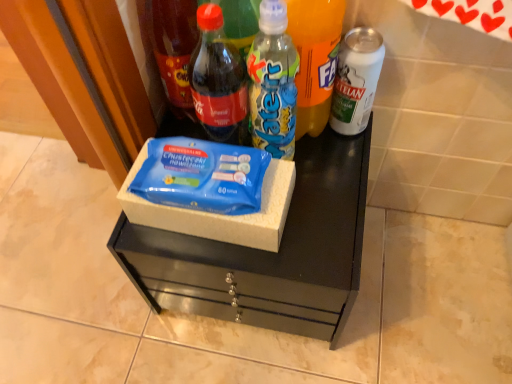
This screenshot has width=512, height=384. What do you see at coordinates (356, 80) in the screenshot?
I see `white matte can at right, marked as the 1th bottle in a right-to-left arrangement` at bounding box center [356, 80].

This screenshot has width=512, height=384. In order to click on translucent plastic bottle at center, placed as the second bottle when sorted from right to left in this screenshot , I will do `click(315, 59)`.

The height and width of the screenshot is (384, 512). Find the location of `blue matte wipes at center`. blue matte wipes at center is located at coordinates (268, 252).

Image resolution: width=512 pixels, height=384 pixels. Find the location of `matte glass bottle at center, positioned as the 4th bottle in right-to-left order`. matte glass bottle at center, positioned as the 4th bottle in right-to-left order is located at coordinates (218, 81).

The image size is (512, 384). Describe the element at coordinates (218, 81) in the screenshot. I see `matte glass bottle at center, positioned as the second bottle in left-to-right order` at that location.

In order to click on white matte can at right, the fifth bottle viewed from the left in this screenshot , I will do `click(356, 80)`.

In the scene shown: Is translucent plastic bottle at center, the fourth bottle positioned from the left, oriented towards blue matte wipes at center?

No.

Starting from the blue matte wipes at center, which bottle is the 2nd one to the right? Please provide its 2D coordinates.

[(315, 59)]

From the picture: Can you confirm if translucent plastic bottle at center, the fourth bottle positioned from the left, is positioned to the left of blue matte wipes at center?

Incorrect, translucent plastic bottle at center, the fourth bottle positioned from the left, is not on the left side of blue matte wipes at center.

Consider the image. Measure the distance from translucent plastic bottle at center, the fourth bottle positioned from the left, to blue matte wipes at center.

translucent plastic bottle at center, the fourth bottle positioned from the left, and blue matte wipes at center are 9.50 inches apart from each other.

Find the location of a particular element. Image resolution: width=512 pixels, height=384 pixels. bottle that is the 3rd object located behind the translucent plastic water bottle at center, the 3th bottle from the left is located at coordinates (356, 80).

Considering the relative sizes of white matte can at right, marked as the 1th bottle in a right-to-left arrangement, and translucent plastic water bottle at center, the 3th bottle from the left, in the image provided, is white matte can at right, marked as the 1th bottle in a right-to-left arrangement, thinner than translucent plastic water bottle at center, the 3th bottle from the left,?

Incorrect, the width of white matte can at right, marked as the 1th bottle in a right-to-left arrangement, is not less than that of translucent plastic water bottle at center, the 3th bottle from the left.

From a real-world perspective, is white matte can at right, the fifth bottle viewed from the left, physically below translucent plastic water bottle at center, the 3th bottle from the left?

Indeed, from a real-world perspective, white matte can at right, the fifth bottle viewed from the left, is positioned beneath translucent plastic water bottle at center, the 3th bottle from the left.

Is the position of matte glass bottle at upper left, arranged as the 5th bottle when viewed from the right, more distant than that of translucent plastic water bottle at center, which is counted as the third bottle, starting from the right?

Yes, the depth of matte glass bottle at upper left, arranged as the 5th bottle when viewed from the right, is greater than that of translucent plastic water bottle at center, which is counted as the third bottle, starting from the right.

Is point (188, 7) closer or farther from the camera than point (255, 41)?

Point (188, 7) is positioned farther from the camera compared to point (255, 41).

Considering the relative sizes of matte glass bottle at upper left, arranged as the 5th bottle when viewed from the right, and translucent plastic water bottle at center, which is counted as the third bottle, starting from the right, in the image provided, is matte glass bottle at upper left, arranged as the 5th bottle when viewed from the right, smaller than translucent plastic water bottle at center, which is counted as the third bottle, starting from the right,?

No, matte glass bottle at upper left, arranged as the 5th bottle when viewed from the right, is not smaller than translucent plastic water bottle at center, which is counted as the third bottle, starting from the right.

From the picture: Is blue matte wipes at center closer to the viewer compared to white matte can at right, the fifth bottle viewed from the left?

Yes, blue matte wipes at center is closer to the camera.

Looking at this image, would you say blue matte wipes at center is inside or outside white matte can at right, marked as the 1th bottle in a right-to-left arrangement?

blue matte wipes at center is not inside white matte can at right, marked as the 1th bottle in a right-to-left arrangement, it's outside.

Looking at this image, measure the distance between blue matte wipes at center and white matte can at right, marked as the 1th bottle in a right-to-left arrangement.

9.97 inches.

In terms of height, does blue matte wipes at center look taller or shorter compared to white matte can at right, the fifth bottle viewed from the left?

Clearly, blue matte wipes at center is taller compared to white matte can at right, the fifth bottle viewed from the left.

Who is more distant, translucent plastic bottle at center, the fourth bottle positioned from the left, or matte glass bottle at center, positioned as the 4th bottle in right-to-left order?

matte glass bottle at center, positioned as the 4th bottle in right-to-left order, is further from the camera.

Which is farther, (319, 68) or (241, 78)?

The point (319, 68) is farther.

From the image's perspective, would you say translucent plastic bottle at center, placed as the second bottle when sorted from right to left, is shown under matte glass bottle at center, positioned as the 4th bottle in right-to-left order?

Incorrect, from the image's perspective, translucent plastic bottle at center, placed as the second bottle when sorted from right to left, is higher than matte glass bottle at center, positioned as the 4th bottle in right-to-left order.

Considering the positions of objects translucent plastic bottle at center, placed as the second bottle when sorted from right to left, and matte glass bottle at center, positioned as the 4th bottle in right-to-left order, in the image provided, who is more to the left, translucent plastic bottle at center, placed as the second bottle when sorted from right to left, or matte glass bottle at center, positioned as the 4th bottle in right-to-left order,?

matte glass bottle at center, positioned as the 4th bottle in right-to-left order.

In the image, is translucent plastic water bottle at center, which is counted as the third bottle, starting from the right, positioned in front of or behind matte glass bottle at center, positioned as the 4th bottle in right-to-left order?

Clearly, translucent plastic water bottle at center, which is counted as the third bottle, starting from the right, is in front of matte glass bottle at center, positioned as the 4th bottle in right-to-left order.

Identify the location of the 1st bottle in front of the matte glass bottle at center, positioned as the second bottle in left-to-right order. (273, 83).

Is translucent plastic water bottle at center, the 3th bottle from the left, facing away from matte glass bottle at center, positioned as the second bottle in left-to-right order?

No.

Consider the image. From the image's perspective, is matte glass bottle at center, positioned as the 4th bottle in right-to-left order, beneath white matte can at right, the fifth bottle viewed from the left?

Yes, from the image's perspective, matte glass bottle at center, positioned as the 4th bottle in right-to-left order, is beneath white matte can at right, the fifth bottle viewed from the left.

How distant is matte glass bottle at center, positioned as the 4th bottle in right-to-left order, from white matte can at right, the fifth bottle viewed from the left?

The distance of matte glass bottle at center, positioned as the 4th bottle in right-to-left order, from white matte can at right, the fifth bottle viewed from the left, is 7.07 inches.

Considering the sizes of objects matte glass bottle at center, positioned as the 4th bottle in right-to-left order, and white matte can at right, the fifth bottle viewed from the left, in the image provided, who is smaller, matte glass bottle at center, positioned as the 4th bottle in right-to-left order, or white matte can at right, the fifth bottle viewed from the left,?

white matte can at right, the fifth bottle viewed from the left, is smaller.

Based on the photo, is matte glass bottle at center, positioned as the second bottle in left-to-right order, far away from white matte can at right, marked as the 1th bottle in a right-to-left arrangement?

matte glass bottle at center, positioned as the second bottle in left-to-right order, is near white matte can at right, marked as the 1th bottle in a right-to-left arrangement, not far away.

From a real-world perspective, which bottle is the 4th one above the blue matte wipes at center? Please provide its 2D coordinates.

[(315, 59)]

The height and width of the screenshot is (384, 512). Find the location of `the 2nd bottle counting from the right side of the translucent plastic water bottle at center, the 3th bottle from the left`. the 2nd bottle counting from the right side of the translucent plastic water bottle at center, the 3th bottle from the left is located at coordinates (356, 80).

Which object lies nearer to the anchor point white matte can at right, the fifth bottle viewed from the left, matte glass bottle at center, positioned as the second bottle in left-to-right order, or translucent plastic water bottle at center, the 3th bottle from the left?

The object closer to white matte can at right, the fifth bottle viewed from the left, is translucent plastic water bottle at center, the 3th bottle from the left.

Looking at the image, which one is located further to blue matte wipes at center, matte glass bottle at center, positioned as the 4th bottle in right-to-left order, or translucent plastic bottle at center, placed as the second bottle when sorted from right to left?

translucent plastic bottle at center, placed as the second bottle when sorted from right to left.

Considering their positions, is matte glass bottle at upper left, which ranks as the first bottle in left-to-right order, positioned further to translucent plastic bottle at center, placed as the second bottle when sorted from right to left, than blue matte wipes at center?

The object further to translucent plastic bottle at center, placed as the second bottle when sorted from right to left, is blue matte wipes at center.

In the scene shown: Looking at the image, which one is located closer to blue matte wipes at center, matte glass bottle at center, positioned as the second bottle in left-to-right order, or blue cardboard box at center?

Among the two, blue cardboard box at center is located nearer to blue matte wipes at center.

Considering their positions, is white matte can at right, the fifth bottle viewed from the left, positioned further to matte glass bottle at center, positioned as the second bottle in left-to-right order, than translucent plastic bottle at center, placed as the second bottle when sorted from right to left?

white matte can at right, the fifth bottle viewed from the left.

Based on the photo, looking at the image, which one is located further to blue matte wipes at center, translucent plastic water bottle at center, the 3th bottle from the left, or blue cardboard box at center?

Among the two, translucent plastic water bottle at center, the 3th bottle from the left, is located further to blue matte wipes at center.

Based on their spatial positions, is blue matte wipes at center or matte glass bottle at upper left, which ranks as the first bottle in left-to-right order, closer to translucent plastic bottle at center, placed as the second bottle when sorted from right to left?

Based on the image, matte glass bottle at upper left, which ranks as the first bottle in left-to-right order, appears to be nearer to translucent plastic bottle at center, placed as the second bottle when sorted from right to left.

Consider the image. Based on their spatial positions, is matte glass bottle at upper left, which ranks as the first bottle in left-to-right order, or matte glass bottle at center, positioned as the second bottle in left-to-right order, closer to translucent plastic bottle at center, the fourth bottle positioned from the left?

matte glass bottle at center, positioned as the second bottle in left-to-right order, lies closer to translucent plastic bottle at center, the fourth bottle positioned from the left, than the other object.

Locate an element on the screen. This screenshot has width=512, height=384. bottle between matte glass bottle at center, positioned as the 4th bottle in right-to-left order, and blue cardboard box at center vertically is located at coordinates (273, 83).

The height and width of the screenshot is (384, 512). I want to click on box between matte glass bottle at center, positioned as the 4th bottle in right-to-left order, and blue matte wipes at center vertically, so click(x=210, y=191).

This screenshot has width=512, height=384. I want to click on bottle between matte glass bottle at center, positioned as the 4th bottle in right-to-left order, and translucent plastic bottle at center, placed as the second bottle when sorted from right to left, from left to right, so (273, 83).

Where is `bottle located between translucent plastic water bottle at center, which is counted as the third bottle, starting from the right, and white matte can at right, marked as the 1th bottle in a right-to-left arrangement, in the left-right direction`? This screenshot has width=512, height=384. bottle located between translucent plastic water bottle at center, which is counted as the third bottle, starting from the right, and white matte can at right, marked as the 1th bottle in a right-to-left arrangement, in the left-right direction is located at coordinates (315, 59).